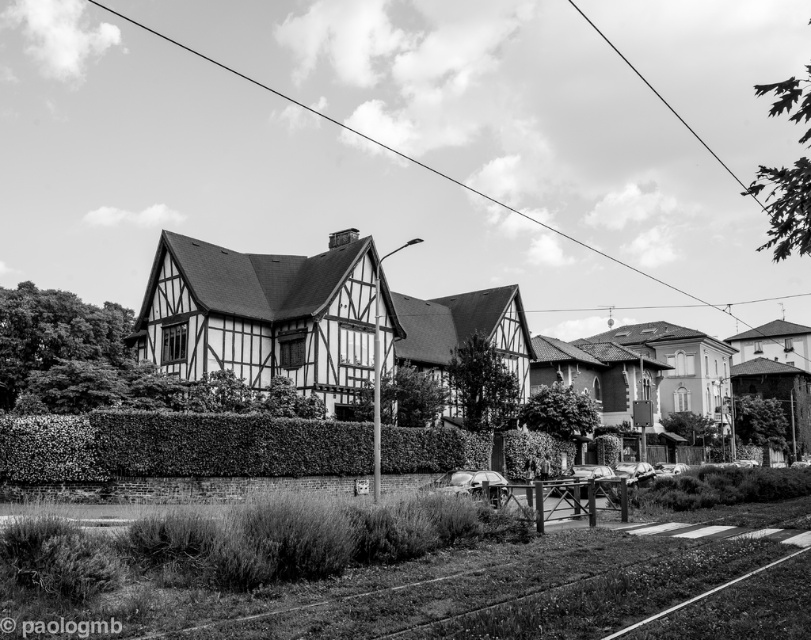
Can you confirm if green leafy hedge at center is shorter than metallic wire at upper center?

Indeed, green leafy hedge at center has a lesser height compared to metallic wire at upper center.

Is green leafy hedge at center bigger than metallic wire at upper center?

Incorrect, green leafy hedge at center is not larger than metallic wire at upper center.

Describe the element at coordinates (177, 445) in the screenshot. The image size is (811, 640). I see `green leafy hedge at center` at that location.

Find the location of a particular element. green leafy hedge at center is located at coordinates (177, 445).